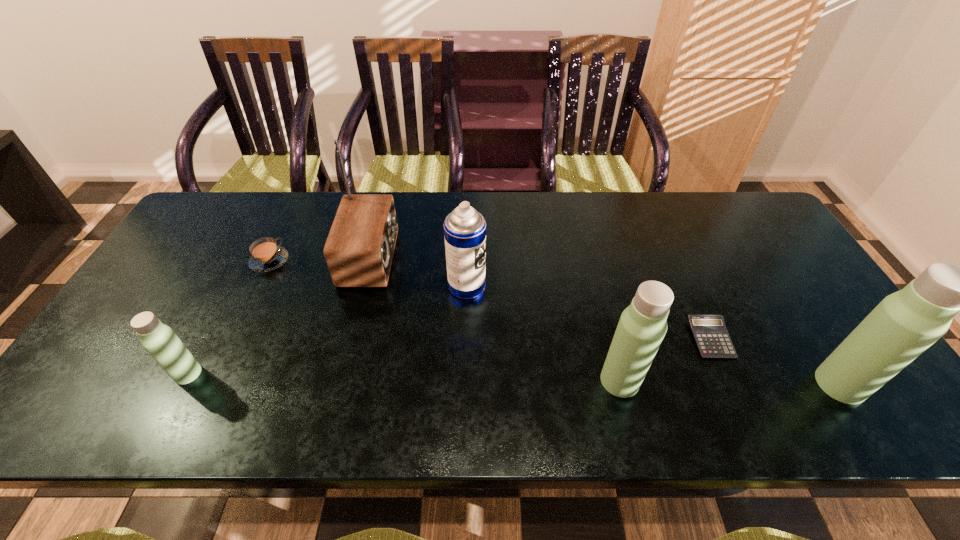
This screenshot has height=540, width=960. What are the coordinates of `free space between the third shortest object and the aerosol can` in the screenshot? It's located at (327, 330).

You are a GUI agent. You are given a task and a screenshot of the screen. Output one action in this format:
    pyautogui.click(x=<x>, y=<y>)
    Task: Click on the vacant space in between the calculator and the rightmost object
    This screenshot has width=960, height=540.
    Given the screenshot: What is the action you would take?
    pyautogui.click(x=776, y=361)

What are the coordinates of `free area in between the fifth object from right to left and the leftmost thermos bottle` in the screenshot? It's located at (279, 315).

This screenshot has height=540, width=960. Find the location of `vacant point located between the fifth object from left to right and the shortest object`. vacant point located between the fifth object from left to right and the shortest object is located at coordinates (665, 360).

Locate an element on the screen. The width and height of the screenshot is (960, 540). empty location between the rightmost thermos bottle and the second tallest thermos bottle is located at coordinates (730, 382).

Find the location of `object that is the fifth nearest to the shortest object`. object that is the fifth nearest to the shortest object is located at coordinates (266, 255).

Where is `object that can be found as the second closest to the radio receiver`? The width and height of the screenshot is (960, 540). object that can be found as the second closest to the radio receiver is located at coordinates (266, 255).

Locate which thermos bottle is the second closest to the leftmost thermos bottle. Please provide its 2D coordinates. Your answer should be formatted as a tuple, i.e. [(x, y)], where the tuple contains the x and y coordinates of a point satisfying the conditions above.

[(904, 324)]

Locate which thermos bottle ranks in proximity to the rightmost object. Please provide its 2D coordinates. Your answer should be formatted as a tuple, i.e. [(x, y)], where the tuple contains the x and y coordinates of a point satisfying the conditions above.

[(642, 326)]

Identify the location of vacant space that satisfies the following two spatial constraints: 1. on the front-facing side of the fifth object from right to left; 2. on the front side of the shortest thermos bottle. The width and height of the screenshot is (960, 540). (x=343, y=374).